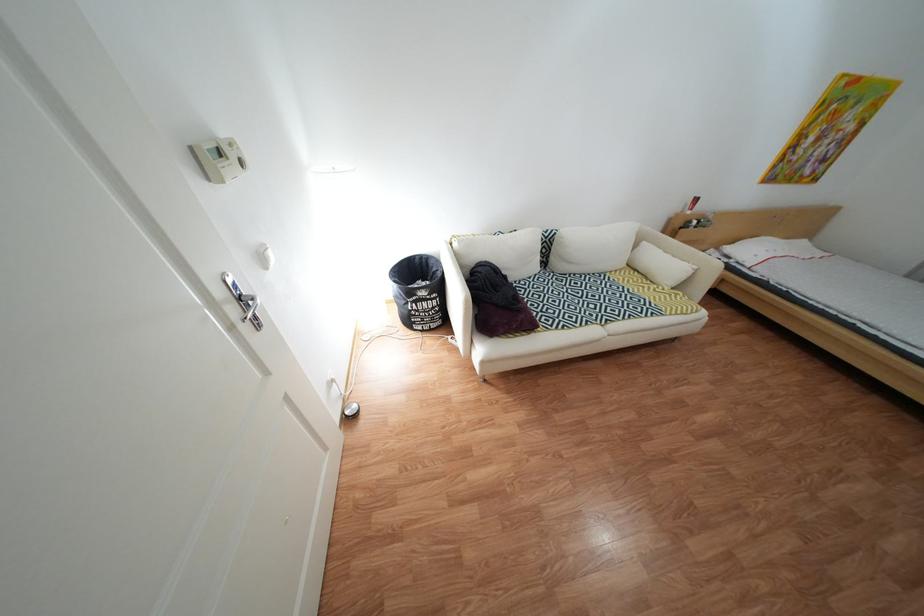
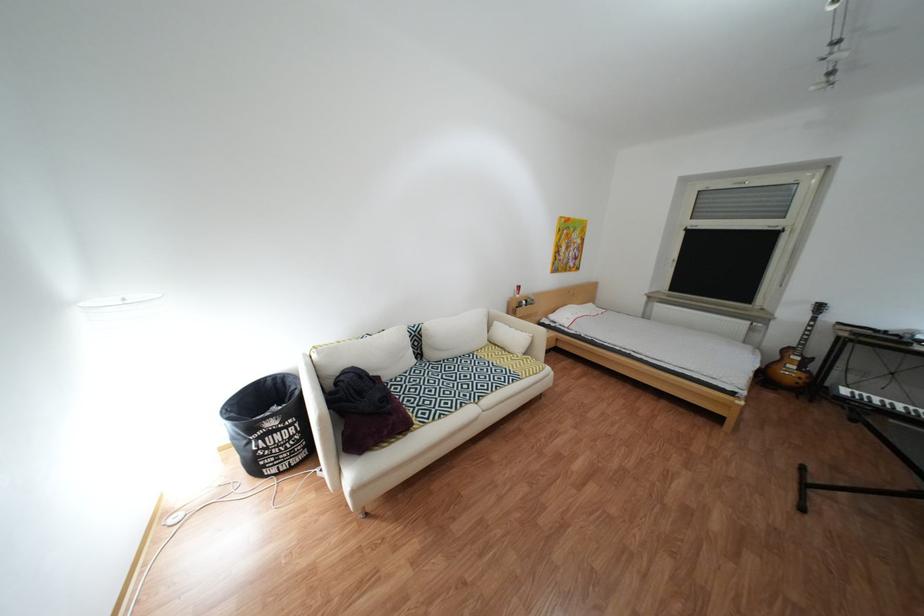
Looking at this image, how did the camera likely rotate?

The rotation direction of the camera is right-up.